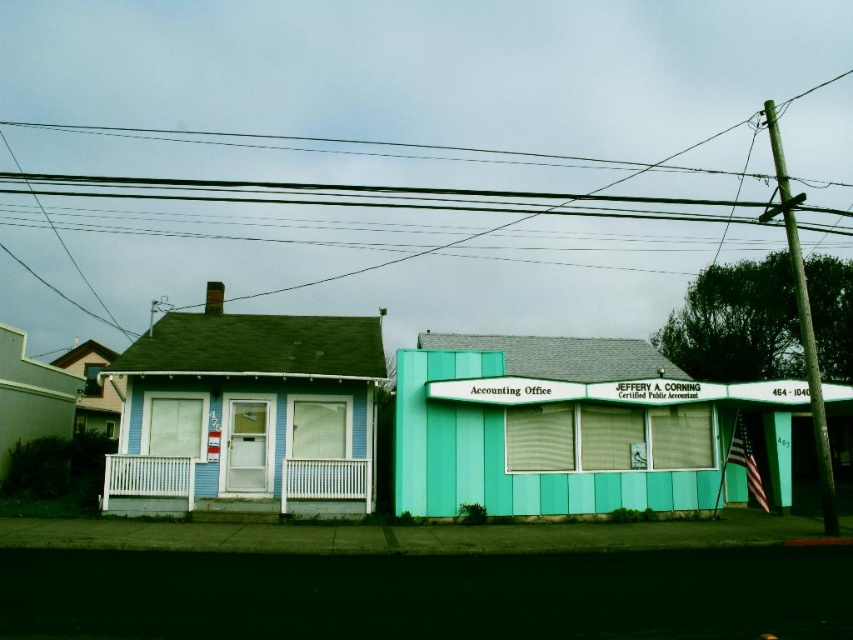
You are a GUI agent. You are given a task and a screenshot of the screen. Output one action in this format:
    pyautogui.click(x=<x>, y=<y>)
    Task: Click on the teal paneling at center
    Image resolution: width=853 pixels, height=640 pixels.
    Given the screenshot: What is the action you would take?
    pyautogui.click(x=566, y=432)

Is the position of teal paneling at center more distant than that of black wire at upper center?

Yes, it is.

Is point (451, 413) less distant than point (262, 198)?

Yes, it is.

What are the coordinates of `teal paneling at center` in the screenshot? It's located at (566, 432).